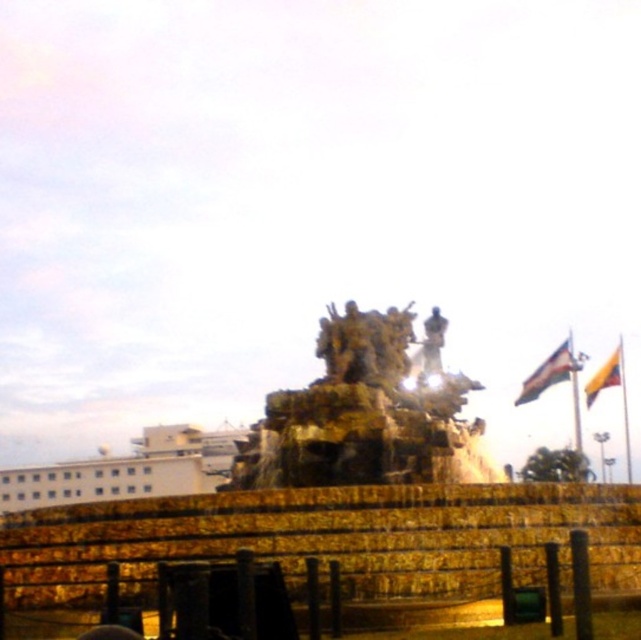
You are standing in the public square and want to take a photo of both the gold metallic fountain at center and the golden stone fountain at center. Which one should you focus on first if you want to capture them both in the same frame without moving your camera?

You should focus on the gold metallic fountain at center first because it is located below the golden stone fountain at center, so adjusting the camera to include the lower one will naturally include the upper one in the frame.

You are standing in the public square facing the fountain. There are two points marked in the scene. Which point, point (408, 420) or point (319, 349), is closer to you?

Point (408, 420) is closer to the viewer than point (319, 349).

You are standing in the public square and want to take a photo of the golden stone fountain at center and the gold textured statue at center. Which object should you position to your left to include both in the frame?

You should position the gold textured statue at center to your left since the golden stone fountain at center is to the right of it, so placing the statue on your left will allow both to be captured in the photo.